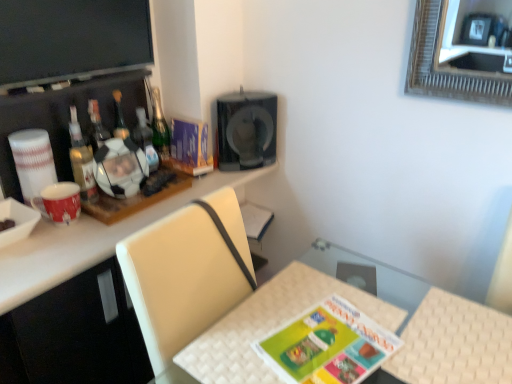
The image size is (512, 384). Identify the location of free point in front of matte red cup at left. (44, 253).